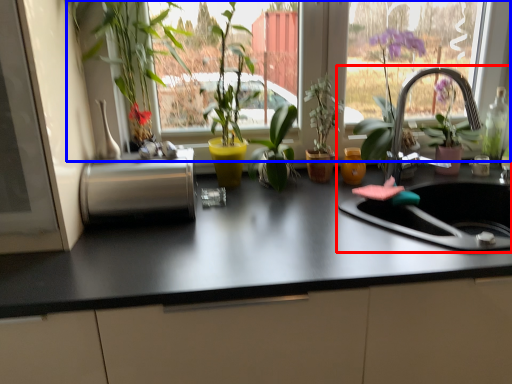
Question: Which of the following is the closest to the observer, sink (highlighted by a red box) or window (highlighted by a blue box)?

Choices:
 (A) sink
 (B) window

Answer: (A)